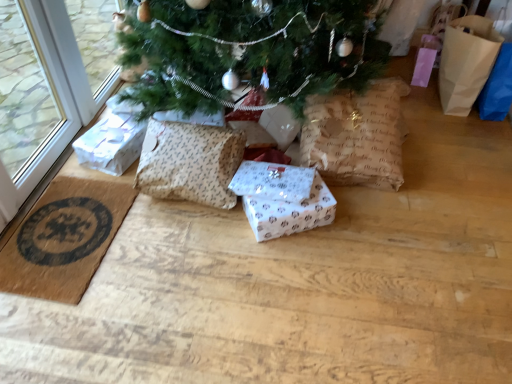
Where is `vacant region above brown woven mat at lower left (from a real-world perspective)`? The image size is (512, 384). vacant region above brown woven mat at lower left (from a real-world perspective) is located at coordinates (59, 243).